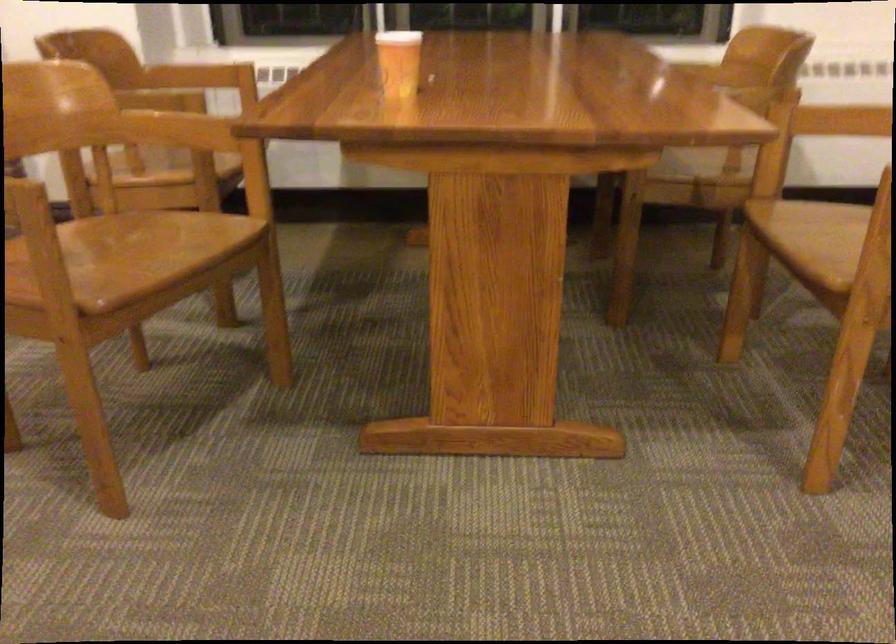
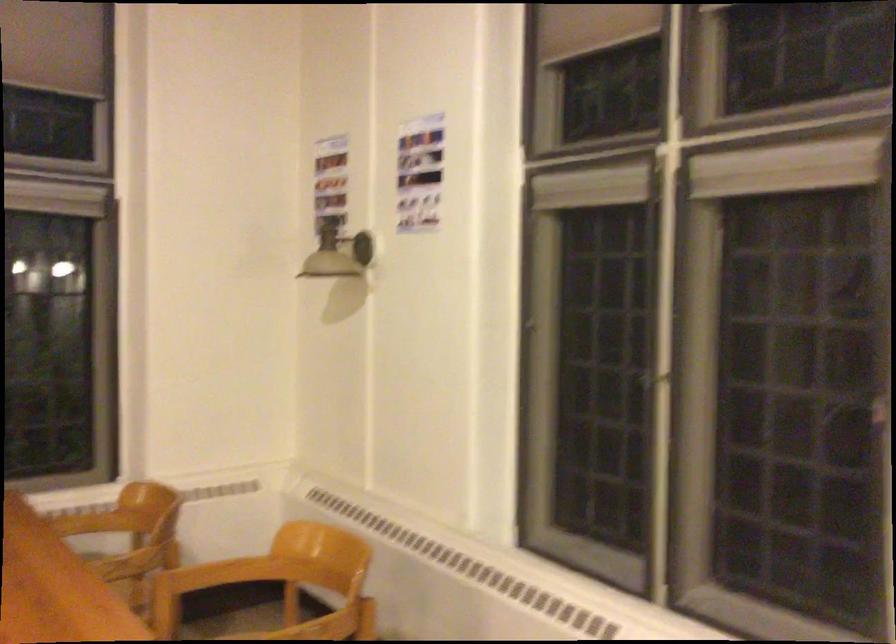
The images are taken continuously from a first-person perspective. In which direction is your viewpoint rotating?

The camera rotated toward right-up.